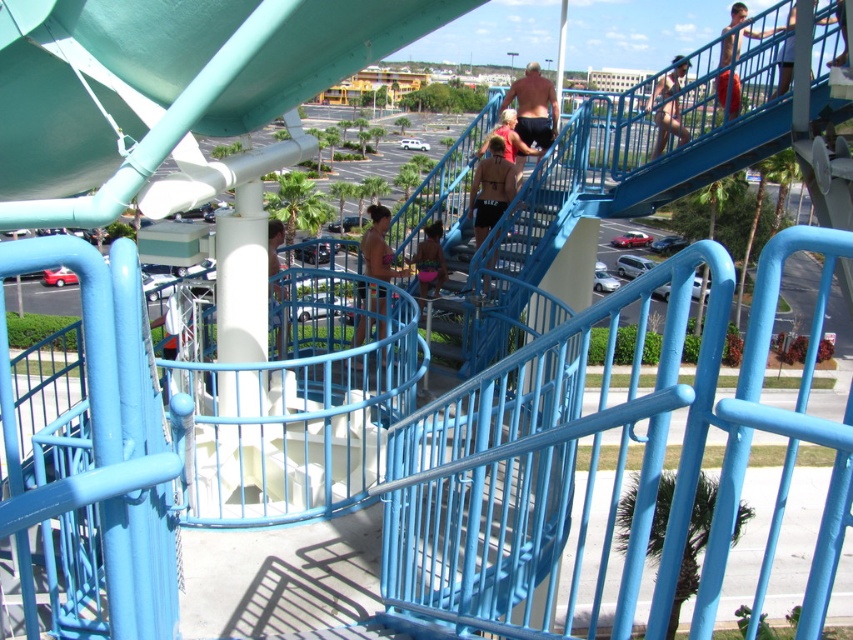
Can you confirm if matte pink shorts at center is positioned to the left of matte pink tank top at center?

Yes, matte pink shorts at center is to the left of matte pink tank top at center.

Does matte pink shorts at center have a greater height compared to matte pink tank top at center?

No, matte pink shorts at center is not taller than matte pink tank top at center.

Describe the element at coordinates (430, 260) in the screenshot. I see `matte pink shorts at center` at that location.

At what (x,y) coordinates should I click in order to perform the action: click on matte pink shorts at center. Please return your answer as a coordinate pair (x, y). Image resolution: width=853 pixels, height=640 pixels. Looking at the image, I should click on (430, 260).

Which is below, shiny black shorts at upper center or matte pink shorts at center?

matte pink shorts at center

Does shiny black shorts at upper center have a larger size compared to matte pink shorts at center?

Correct, shiny black shorts at upper center is larger in size than matte pink shorts at center.

Is point (515, 120) farther from viewer compared to point (410, 262)?

Yes, it is behind point (410, 262).

Identify the location of shiny black shorts at upper center. The width and height of the screenshot is (853, 640). (532, 108).

Which is more to the right, brown leather jacket at center or matte pink shorts at center?

Positioned to the right is brown leather jacket at center.

Can you confirm if brown leather jacket at center is positioned above matte pink shorts at center?

Indeed, brown leather jacket at center is positioned over matte pink shorts at center.

Is point (494, 144) less distant than point (440, 260)?

No, it is not.

The image size is (853, 640). What are the coordinates of `brown leather jacket at center` in the screenshot? It's located at (490, 188).